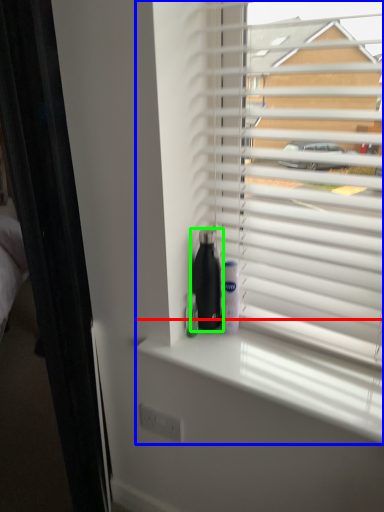
Question: Which object is the closest to the window sill (highlighted by a red box)? Choose among these: window blind (highlighted by a blue box) or bottle (highlighted by a green box).

Choices:
 (A) window blind
 (B) bottle

Answer: (B)